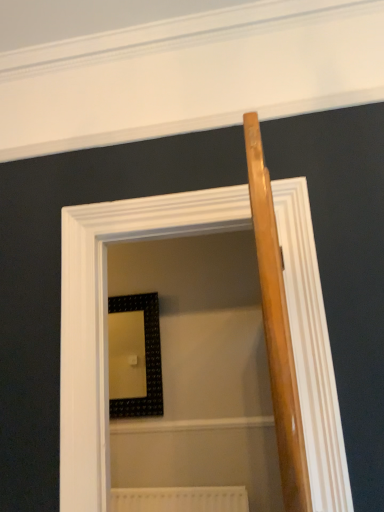
Identify the location of wooden screen door at center. The height and width of the screenshot is (512, 384). (106, 315).

This screenshot has width=384, height=512. What do you see at coordinates (106, 315) in the screenshot?
I see `wooden screen door at center` at bounding box center [106, 315].

Find the location of a particular element. This screenshot has height=512, width=384. white textured radiator at lower center is located at coordinates (180, 499).

Would you say white textured radiator at lower center contains wooden screen door at center?

No, white textured radiator at lower center does not contain wooden screen door at center.

Identify the location of screen door above the white textured radiator at lower center (from the image's perspective). Image resolution: width=384 pixels, height=512 pixels. (106, 315).

Considering the points (201, 495) and (98, 395), which point is in front, point (201, 495) or point (98, 395)?

The point (98, 395) is in front.

Is wooden screen door at center inside or outside of white textured radiator at lower center?

wooden screen door at center is outside white textured radiator at lower center.

From the picture: Between wooden screen door at center and white textured radiator at lower center, which one has larger width?

wooden screen door at center is wider.

Considering the positions of objects wooden screen door at center and white textured radiator at lower center in the image provided, who is more to the right, wooden screen door at center or white textured radiator at lower center?

wooden screen door at center.

Who is more distant, wooden screen door at center or white textured radiator at lower center?

white textured radiator at lower center is further away from the camera.

Choose the correct answer: Is wooden screen door at center inside black textured picture frame at center or outside it?

wooden screen door at center is located beyond the bounds of black textured picture frame at center.

Is wooden screen door at center positioned with its back to black textured picture frame at center?

Yes, wooden screen door at center is positioned with its back facing black textured picture frame at center.

Can you confirm if wooden screen door at center is taller than black textured picture frame at center?

Correct, wooden screen door at center is much taller as black textured picture frame at center.

In terms of height, does white textured radiator at lower center look taller or shorter compared to black textured picture frame at center?

In the image, white textured radiator at lower center appears to be shorter than black textured picture frame at center.

Which is closer to the camera, (184, 499) or (160, 412)?

Clearly, point (184, 499) is closer to the camera than point (160, 412).

Is white textured radiator at lower center outside of black textured picture frame at center?

Yes, white textured radiator at lower center is outside of black textured picture frame at center.

Is white textured radiator at lower center bigger than black textured picture frame at center?

Incorrect, white textured radiator at lower center is not larger than black textured picture frame at center.

Considering the positions of objects black textured picture frame at center and white textured radiator at lower center in the image provided, who is in front, black textured picture frame at center or white textured radiator at lower center?

white textured radiator at lower center is closer to the camera.

Consider the image. What's the angular difference between black textured picture frame at center and white textured radiator at lower center's facing directions?

black textured picture frame at center and white textured radiator at lower center are facing 0.00409 degrees away from each other.

Considering the sizes of black textured picture frame at center and white textured radiator at lower center in the image, is black textured picture frame at center taller or shorter than white textured radiator at lower center?

Clearly, black textured picture frame at center is taller compared to white textured radiator at lower center.

Is black textured picture frame at center far from white textured radiator at lower center?

Yes.

Is black textured picture frame at center facing away from wooden screen door at center?

No, wooden screen door at center is not at the back of black textured picture frame at center.

Considering the relative positions of black textured picture frame at center and wooden screen door at center in the image provided, is black textured picture frame at center to the left or to the right of wooden screen door at center?

Clearly, black textured picture frame at center is on the left of wooden screen door at center in the image.

Between black textured picture frame at center and wooden screen door at center, which one has larger size?

With larger size is wooden screen door at center.

The height and width of the screenshot is (512, 384). I want to click on radiator below the wooden screen door at center (from a real-world perspective), so click(180, 499).

Identify the location of screen door that appears above the white textured radiator at lower center (from the image's perspective). Image resolution: width=384 pixels, height=512 pixels. (106, 315).

From the picture: Estimate the real-world distances between objects in this image. Which object is closer to black textured picture frame at center, white textured radiator at lower center or wooden screen door at center?

Among the two, white textured radiator at lower center is located nearer to black textured picture frame at center.

From the image, which object appears to be farther from white textured radiator at lower center, black textured picture frame at center or wooden screen door at center?

wooden screen door at center is further to white textured radiator at lower center.

Considering their positions, is black textured picture frame at center positioned closer to wooden screen door at center than white textured radiator at lower center?

Based on the image, white textured radiator at lower center appears to be nearer to wooden screen door at center.

When comparing their distances from black textured picture frame at center, does wooden screen door at center or white textured radiator at lower center seem further?

Based on the image, wooden screen door at center appears to be further to black textured picture frame at center.

Looking at the image, which one is located closer to wooden screen door at center, white textured radiator at lower center or black textured picture frame at center?

Among the two, white textured radiator at lower center is located nearer to wooden screen door at center.

Estimate the real-world distances between objects in this image. Which object is closer to white textured radiator at lower center, wooden screen door at center or black textured picture frame at center?

black textured picture frame at center is positioned closer to the anchor white textured radiator at lower center.

The width and height of the screenshot is (384, 512). I want to click on radiator located between wooden screen door at center and black textured picture frame at center in the depth direction, so click(x=180, y=499).